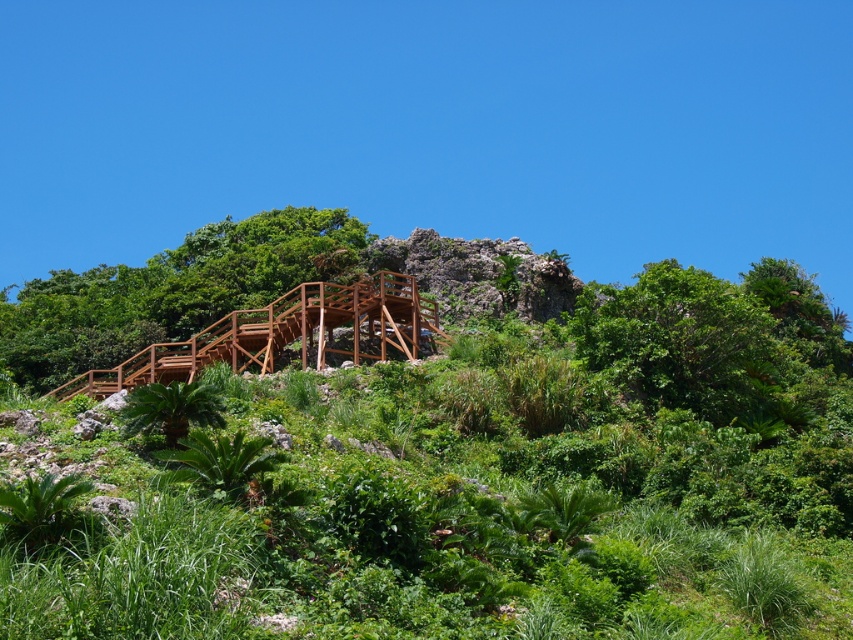
You are a hiker carrying a 30 meter long rope. You need to secure your gear between the brown wooden staircase at upper center and the green leafy plant at lower left. Is the rope long enough to stretch between them?

The brown wooden staircase at upper center is 41.46 meters from the green leafy plant at lower left. Since the rope is only 30 meters long, it is not long enough to stretch between them.

From the picture: You are standing at the bottom of the brown wooden staircase at upper center and want to reach the rocky outcrop at the top. The point marked at coordinate point [170,291] is part of the staircase. Is this point closer to the top or the bottom of the staircase?

The point marked at coordinate point [170,291] is on brown wooden staircase at upper center, so it is closer to the top of the staircase than the bottom.

You are planning to take a photo of the brown wooden staircase at upper center and the green leafy plant at lower left. Which object should you focus on first if you want to capture both in a single frame without moving the camera?

The brown wooden staircase at upper center is larger in size than the green leafy plant at lower left, so you should focus on the brown wooden staircase at upper center first to ensure it fills the frame appropriately while still including the smaller green leafy plant at lower left.